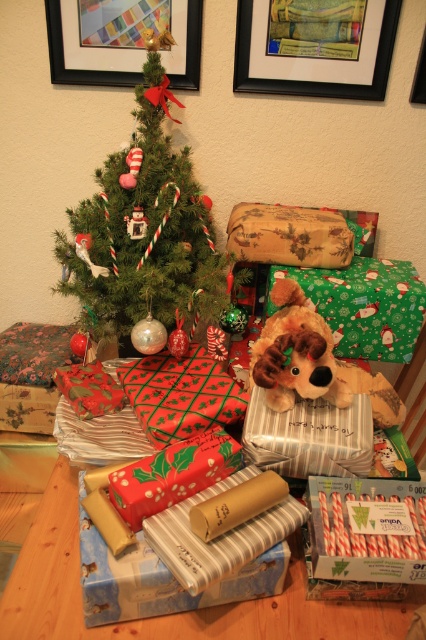
Question: Can you confirm if wooden table at lower center is positioned below red striped candy canes at center?

Choices:
 (A) no
 (B) yes

Answer: (B)

Question: In this image, where is wooden table at lower center located relative to black plastic picture frame at upper right?

Choices:
 (A) below
 (B) above

Answer: (A)

Question: In this image, where is shiny red wrapping paper at center located relative to holly-patterned paper at center?

Choices:
 (A) right
 (B) left

Answer: (B)

Question: Which object is closer to the camera taking this photo?

Choices:
 (A) black plastic picture frame at upper right
 (B) green matte christmas tree at upper center

Answer: (B)

Question: Estimate the real-world distances between objects in this image. Which object is farther from the shiny red wrapping paper at center?

Choices:
 (A) holly-patterned paper at center
 (B) green matte christmas tree at upper center
 (C) wooden picture frame at upper center
 (D) red striped candy canes at center

Answer: (C)

Question: Among these objects, which one is nearest to the camera?

Choices:
 (A) wooden picture frame at upper center
 (B) holly-patterned paper at center
 (C) brushed metal picture frame at upper center
 (D) green matte christmas tree at upper center

Answer: (B)